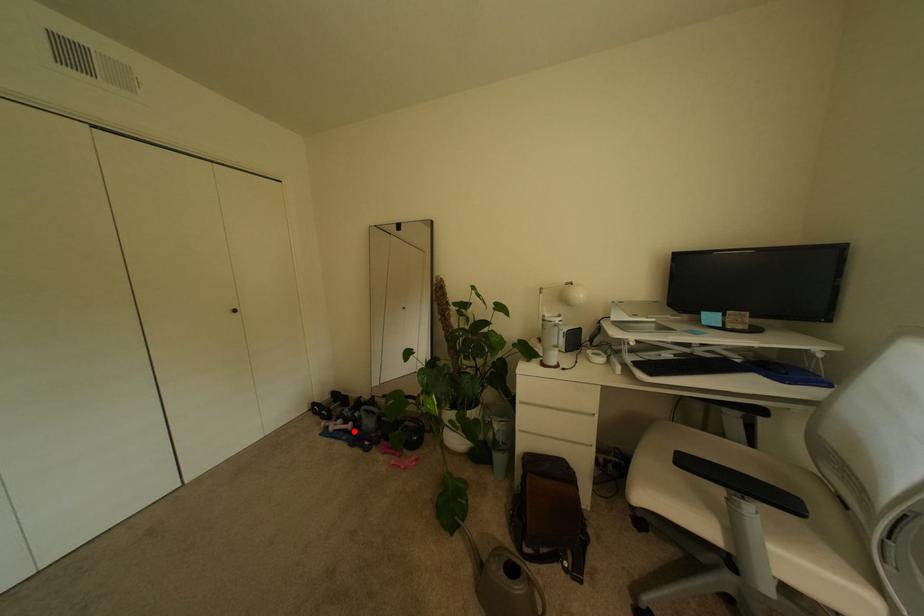
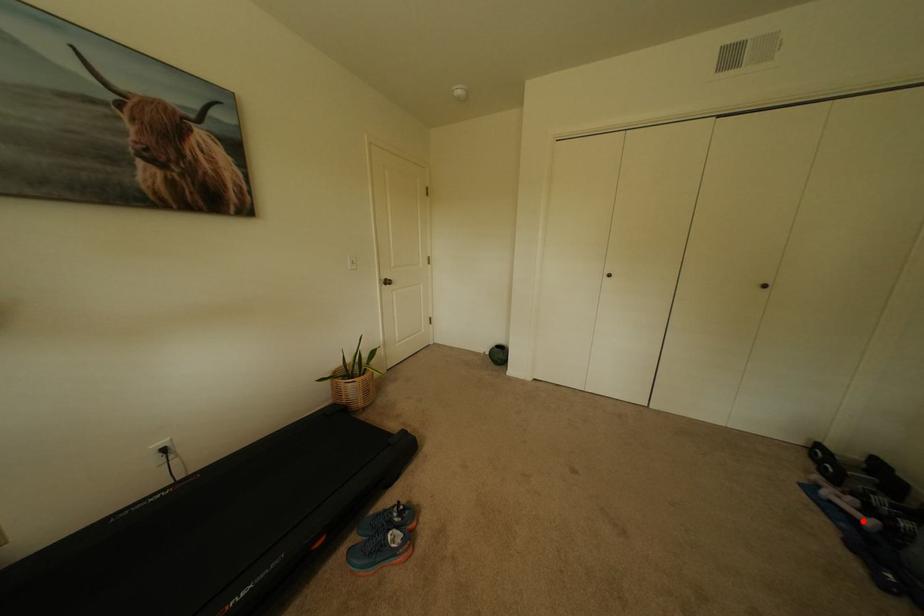
I am providing you with two images of the same scene from different viewpoints. A red point is marked on the first image and another point is marked on the second image. Do the highlighted points in image1 and image2 indicate the same real-world spot?

Yes